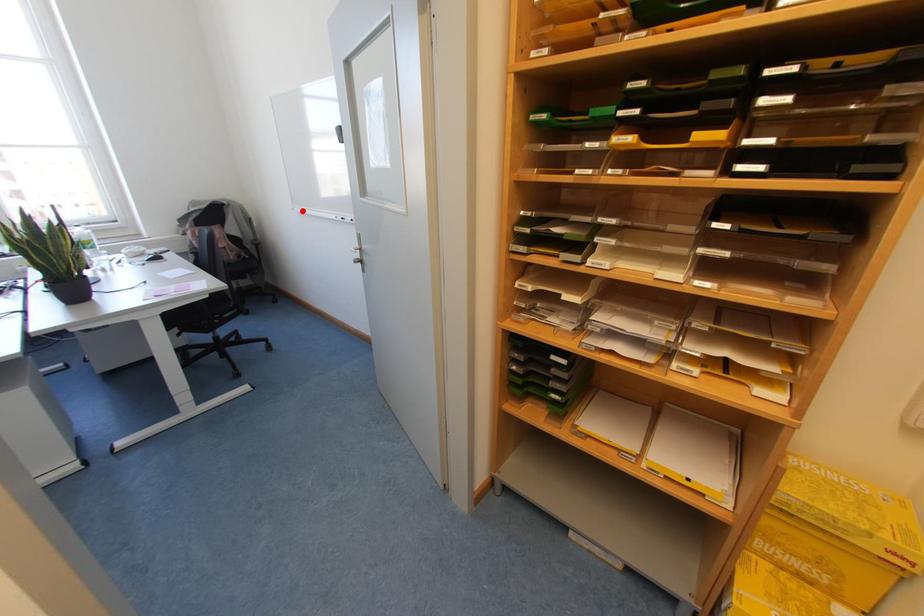
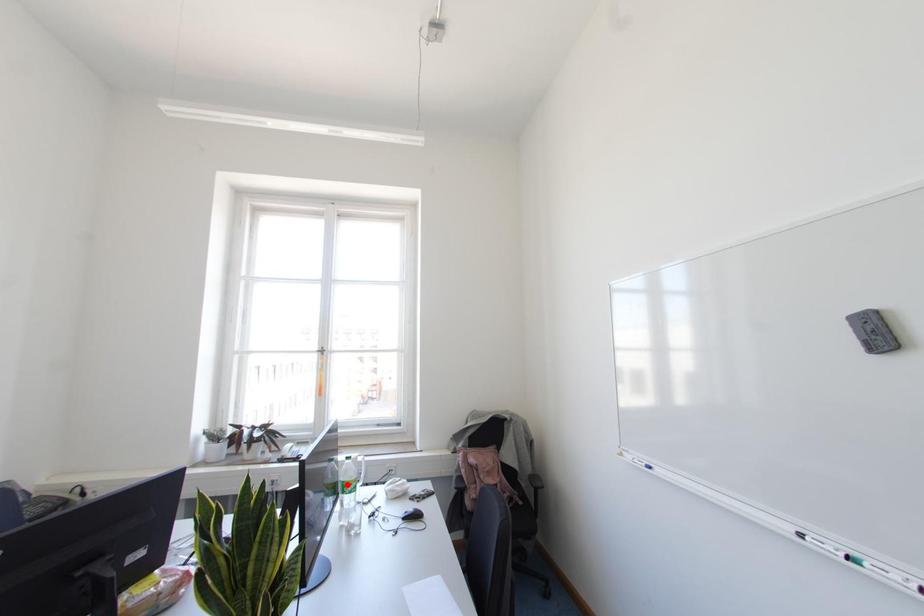
I am providing you with two images of the same scene from different viewpoints. A red point is marked on the first image and another point is marked on the second image. Does the point marked in image1 correspond to the same location as the one in image2?

No